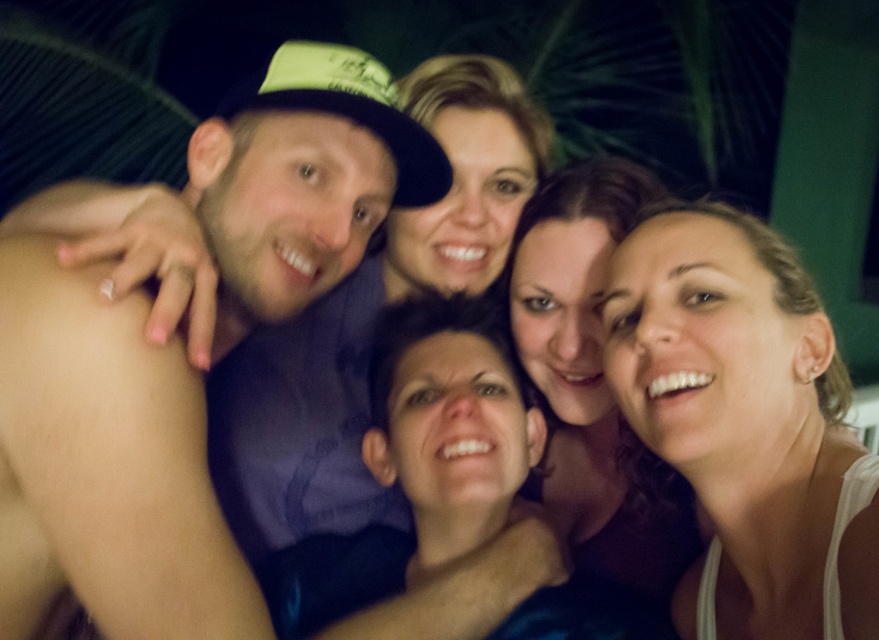
Question: Which object appears closest to the camera in this image?

Choices:
 (A) smooth brown hair at center
 (B) matte black hat at upper left

Answer: (B)

Question: Which of these objects is positioned farthest from the white matte tank top at center?

Choices:
 (A) matte black hat at upper left
 (B) smooth brown hair at center

Answer: (A)

Question: Is white matte tank top at center positioned behind smooth brown hair at center?

Choices:
 (A) no
 (B) yes

Answer: (A)

Question: Can you confirm if matte black hat at upper left is bigger than white matte tank top at center?

Choices:
 (A) no
 (B) yes

Answer: (B)

Question: Is white matte tank top at center to the right of smooth brown hair at center from the viewer's perspective?

Choices:
 (A) yes
 (B) no

Answer: (A)

Question: Which of the following is the farthest from the observer?

Choices:
 (A) smooth brown hair at center
 (B) matte black hat at upper left
 (C) white matte tank top at center

Answer: (A)